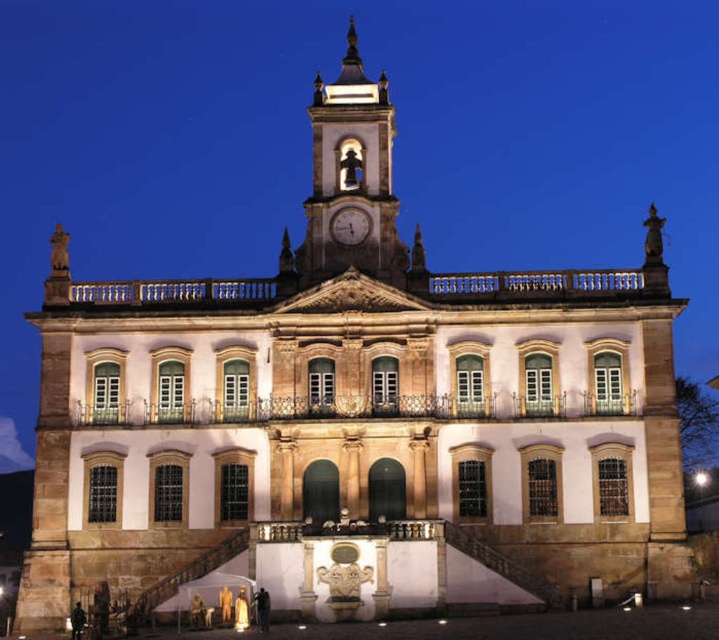
Question: Can you confirm if polished stone clock tower at center is positioned below metallic clock at center?

Choices:
 (A) no
 (B) yes

Answer: (A)

Question: Does polished stone clock tower at center have a greater width compared to metallic clock at center?

Choices:
 (A) no
 (B) yes

Answer: (B)

Question: Which point is farther from the camera taking this photo?

Choices:
 (A) (365, 211)
 (B) (321, 88)

Answer: (B)

Question: Which of the following is the closest to the observer?

Choices:
 (A) (338, 232)
 (B) (303, 204)

Answer: (A)

Question: Which point is farther to the camera?

Choices:
 (A) (366, 212)
 (B) (296, 268)

Answer: (A)

Question: Can you confirm if polished stone clock tower at center is thinner than metallic clock at center?

Choices:
 (A) yes
 (B) no

Answer: (B)